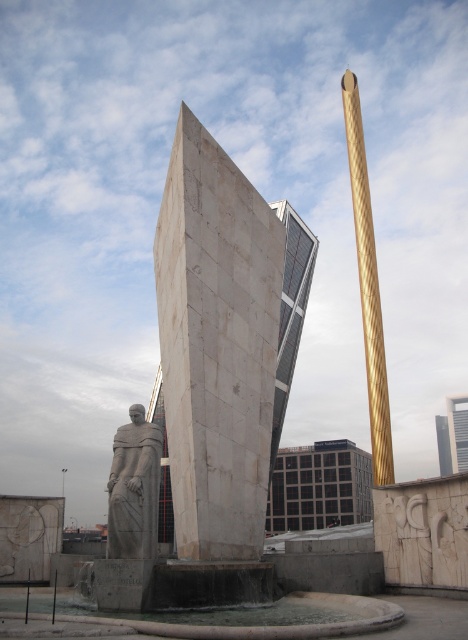
Is point (352, 189) behind point (112, 518)?

Yes, point (352, 189) is behind point (112, 518).

Measure the distance between gold textured obelisk at upper right and gray stone statue at lower left.

gold textured obelisk at upper right and gray stone statue at lower left are 46.47 meters apart from each other.

Which is in front, point (358, 192) or point (123, 529)?

Positioned in front is point (123, 529).

This screenshot has height=640, width=468. Identify the location of gold textured obelisk at upper right. (367, 285).